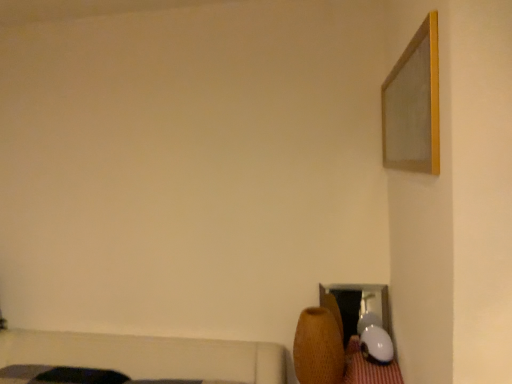
From the picture: What is the approximate height of matte brown vase at lower right?

matte brown vase at lower right is 17.81 inches in height.

Measure the distance between matte brown vase at lower right and camera.

They are 1.71 meters apart.

I want to click on matte brown vase at lower right, so click(338, 343).

The height and width of the screenshot is (384, 512). What do you see at coordinates (338, 343) in the screenshot?
I see `matte brown vase at lower right` at bounding box center [338, 343].

Where is `matte brown vase at lower right`? Image resolution: width=512 pixels, height=384 pixels. matte brown vase at lower right is located at coordinates (338, 343).